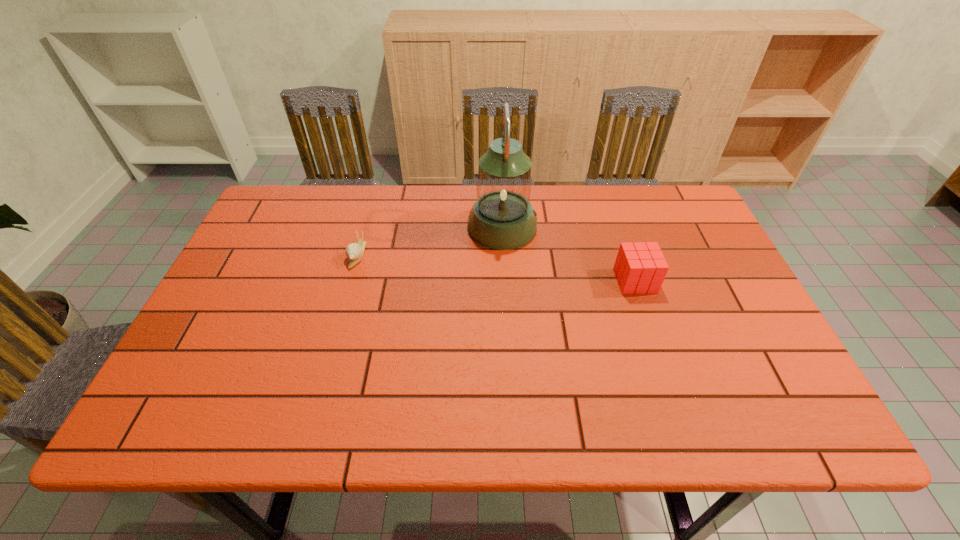
Find the location of a particular element. This screenshot has height=540, width=960. lantern is located at coordinates (502, 218).

At what (x,y) coordinates should I click in order to perform the action: click on the second object from left to right. Please return your answer as a coordinate pair (x, y). Looking at the image, I should click on (502, 218).

Image resolution: width=960 pixels, height=540 pixels. In order to click on the second tallest object in this screenshot , I will do `click(640, 268)`.

The width and height of the screenshot is (960, 540). What are the coordinates of `the rightmost object` in the screenshot? It's located at (640, 268).

In order to click on the leftmost object in this screenshot , I will do `click(354, 251)`.

Locate an element on the screen. escargot is located at coordinates (354, 251).

The image size is (960, 540). I want to click on vacant area situated 0.190m on the left of the second object from right to left, so click(x=403, y=227).

Find the location of a particular element. This screenshot has height=540, width=960. vacant space situated on the back of the rightmost object is located at coordinates (618, 232).

This screenshot has width=960, height=540. In order to click on free space located 0.120m on the shell of the escargot in this screenshot , I will do `click(344, 303)`.

This screenshot has height=540, width=960. I want to click on object that is at the far edge, so click(502, 218).